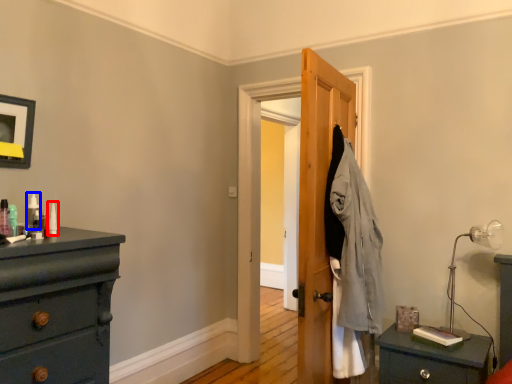
Question: Among these objects, which one is nearest to the camera, toiletry (highlighted by a red box) or toiletry (highlighted by a blue box)?

Choices:
 (A) toiletry
 (B) toiletry

Answer: (B)